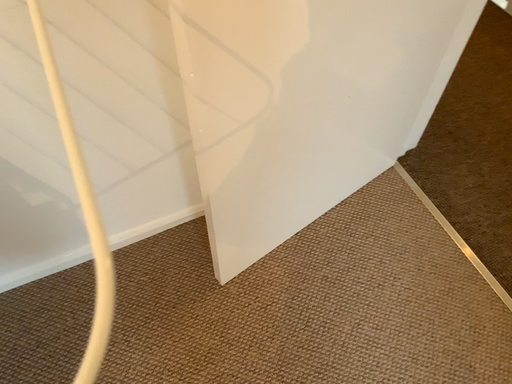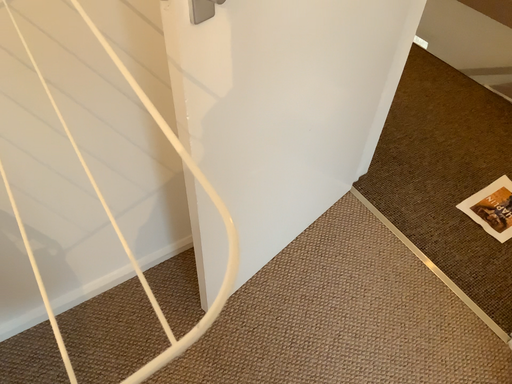
Question: Which way did the camera rotate in the video?

Choices:
 (A) rotated upward
 (B) rotated downward

Answer: (A)